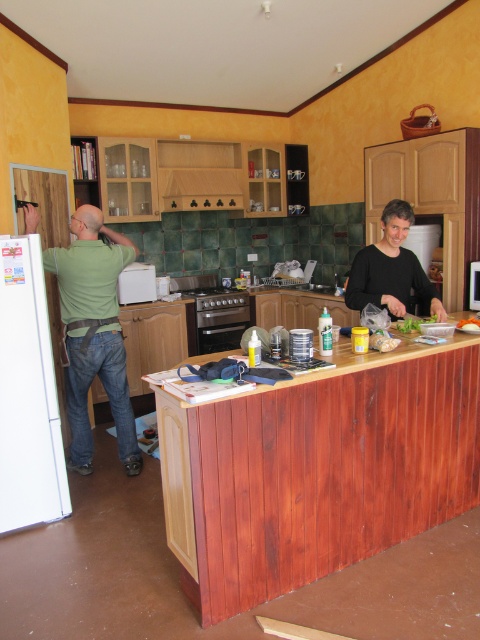
You are a delivery person who needs to place a package on the kitchen counter. The package is 1 meter tall. Considering the green matte shirt at left and the white glossy microwave at upper center, can you fit the package between them without it touching either object?

The green matte shirt at left is taller than the white glossy microwave at upper center. Since the package is 1 meter tall, and the green matte shirt at left is taller than the microwave, the height between them may not be sufficient to accommodate the package without it touching either object. However, without knowing the exact distance between them or their heights, it is difficult to determine definitively. The answer should be based on the given information that the shirt is taller than the microwave,so

You are a delivery person standing in the kitchen and need to place a package on the counter between the white matte refrigerator at left and the green matte shirt at left. Which object should you move first to make space?

The white matte refrigerator at left is closer to the viewer than the green matte shirt at left, so you should move the white matte refrigerator at left first to create space on the counter.